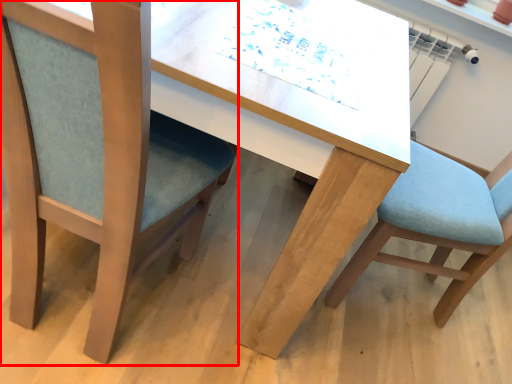
Question: From the image's perspective, where is chair (annotated by the red box) located in relation to chair in the image?

Choices:
 (A) below
 (B) above

Answer: (B)